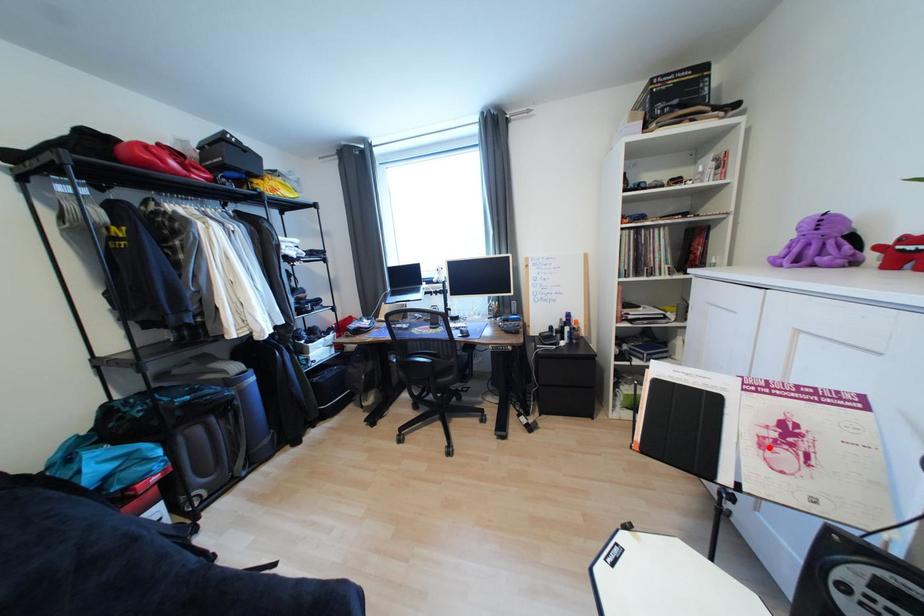
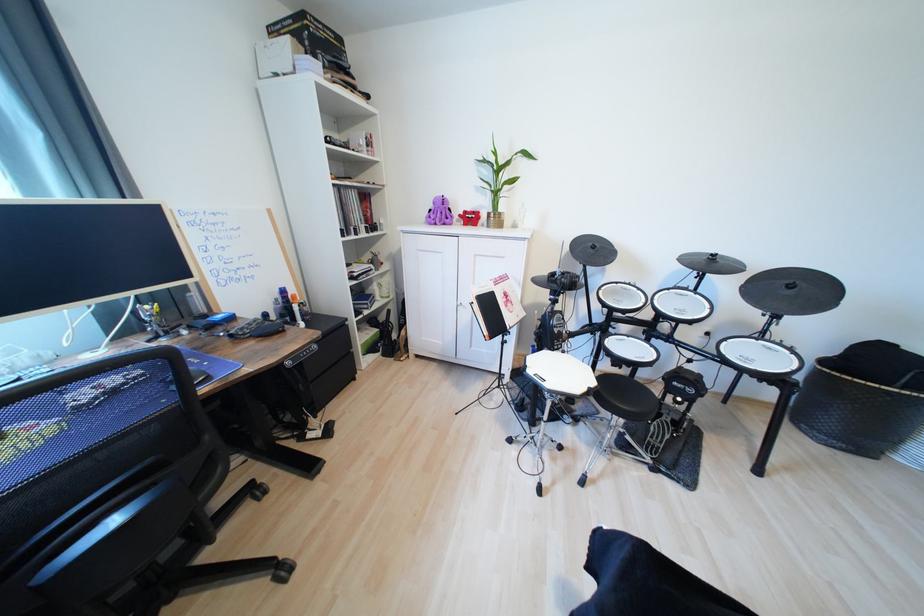
The point at the highlighted location is marked in the first image. Where is the corresponding point in the second image?

(513, 307)